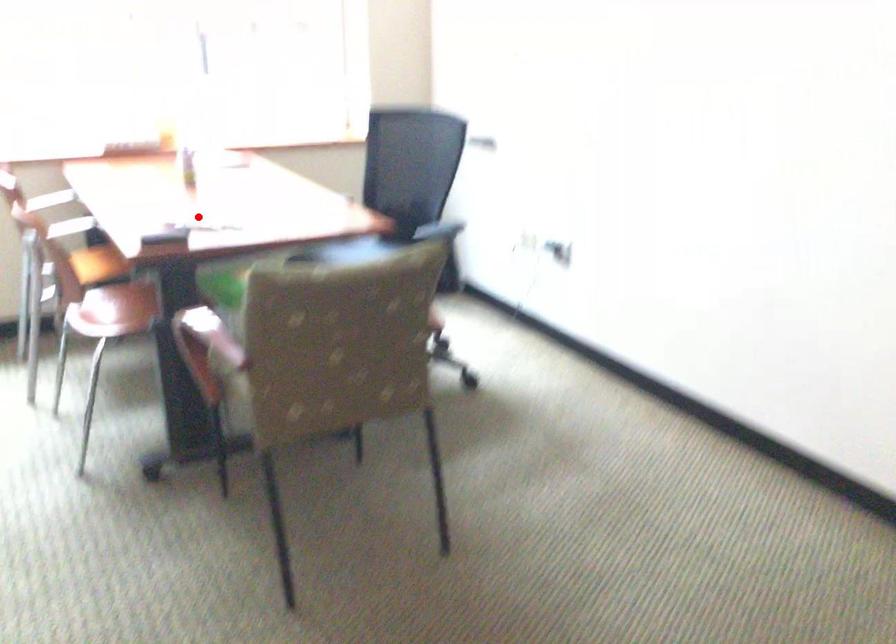
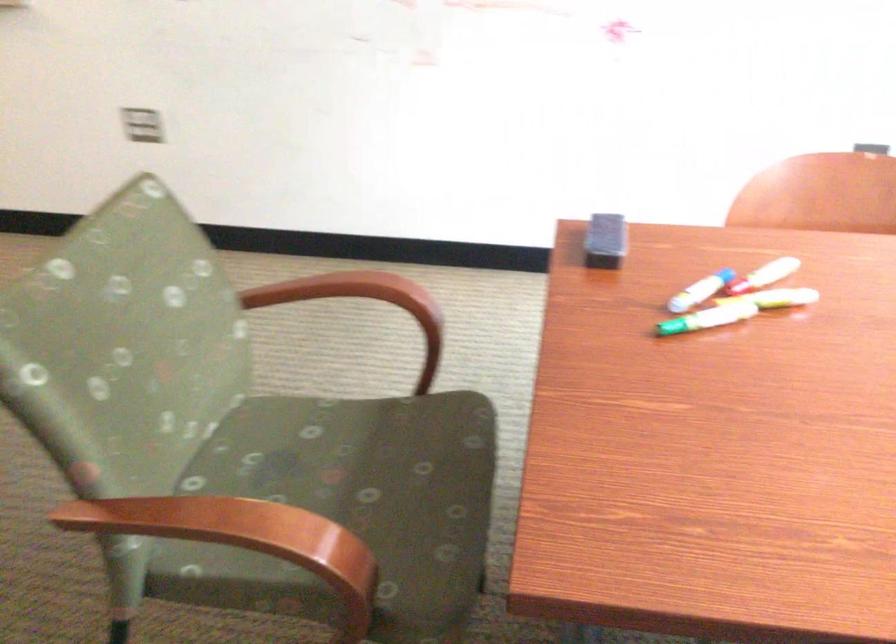
Question: I am providing you with two images of the same scene from different viewpoints. A red point is shown in image1. For the corresponding object point in image2, is it positioned nearer or farther from the camera?

Choices:
 (A) Nearer
 (B) Farther

Answer: (A)